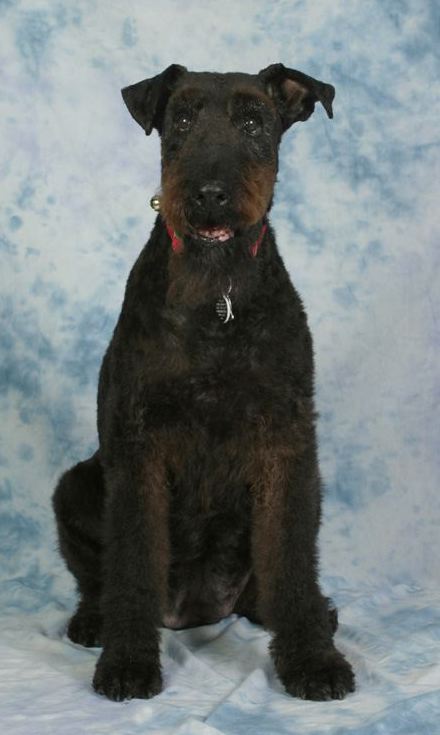
Locate an element on the screen. fabric is located at coordinates (385, 628).